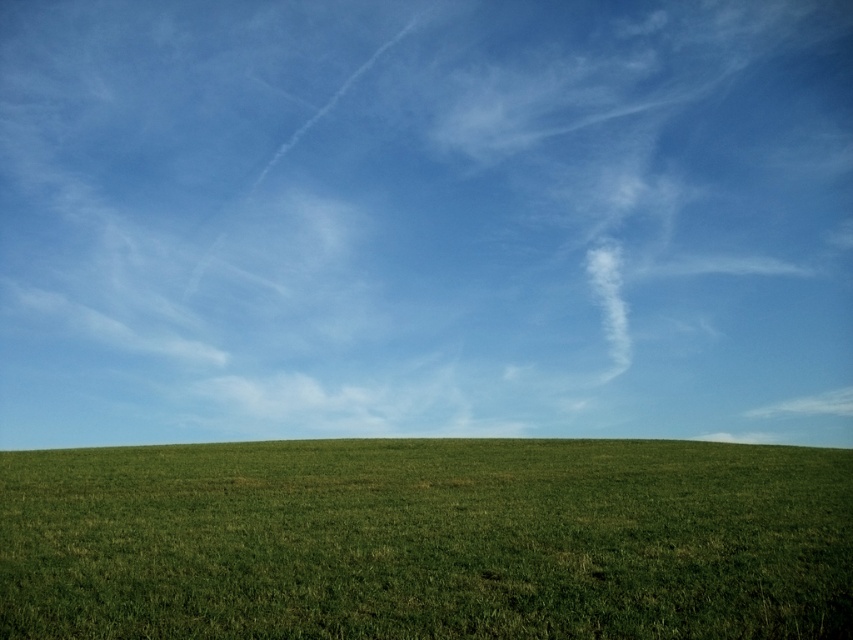
Question: Which point appears closest to the camera in this image?

Choices:
 (A) (135, 435)
 (B) (357, 512)

Answer: (B)

Question: Where is white cotton cloud at upper center located in relation to green grassy field at lower center in the image?

Choices:
 (A) above
 (B) below

Answer: (A)

Question: Which point is closer to the camera taking this photo?

Choices:
 (A) (51, 512)
 (B) (761, 10)

Answer: (A)

Question: Is white cotton cloud at upper center thinner than green grassy field at lower center?

Choices:
 (A) no
 (B) yes

Answer: (A)

Question: Is white cotton cloud at upper center above green grassy field at lower center?

Choices:
 (A) no
 (B) yes

Answer: (B)